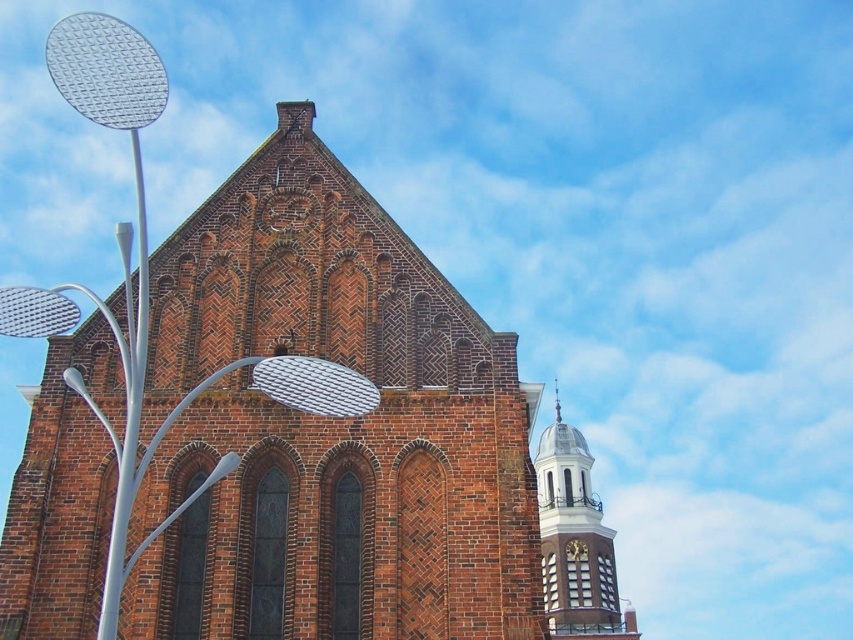
You are standing at the point marked by point (347, 436). Looking at the historic brick building with a steeply pitched roof and decorative gable, which is the main structure in the scene, and the smaller cylindrical tower with a domed top to its right. Which structure is closer to your current position?

The red brick church at center is closer to your current position because it is the main structure represented by the point (347, 436), whereas the smaller tower is located to its right and further away.

You are an architect designing a new building and want to incorporate elements from this historic building. You have two clocks to choose from. The white glossy clock tower at upper right and the gold metallic clock at upper right. Which one is a better option if you want a clock that stands out more in terms of height?

The white glossy clock tower at upper right is much taller than the gold metallic clock at upper right, so it would be a better option if you want a clock that stands out more in terms of height.